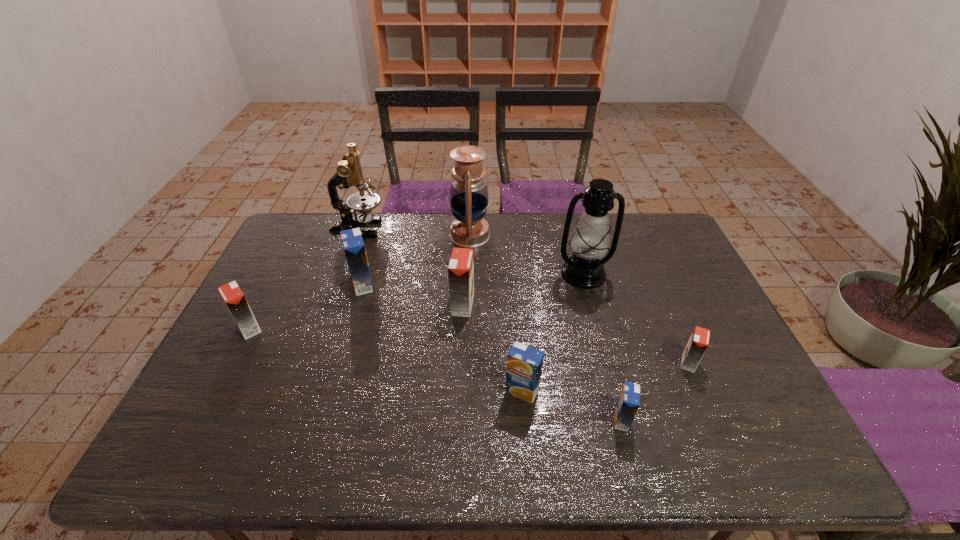
Find the location of a particular element. The height and width of the screenshot is (540, 960). free spot that satisfies the following two spatial constraints: 1. at the eyepiece of the microscope; 2. on the back side of the second orange_juice from left to right is located at coordinates (338, 285).

I want to click on free space that satisfies the following two spatial constraints: 1. on the front side of the farthest orange orange juice; 2. on the right side of the second farthest blue orange_juice, so click(x=459, y=390).

What are the coordinates of `vacant area in the image that satisfies the following two spatial constraints: 1. on the front side of the third nearest orange_juice; 2. on the left side of the third farthest orange_juice` in the screenshot? It's located at (231, 363).

You are a GUI agent. You are given a task and a screenshot of the screen. Output one action in this format:
    pyautogui.click(x=<x>, y=<y>)
    Task: Click on the blank area in the image that satisfies the following two spatial constraints: 1. at the eyepiece of the nearest orange_juice; 2. on the left side of the microscope
    The image size is (960, 540).
    Given the screenshot: What is the action you would take?
    pyautogui.click(x=291, y=420)

Identify the location of vacant space that satisfies the following two spatial constraints: 1. on the front side of the second smallest blue orange_juice; 2. on the left side of the farther oil lamp. point(466,390).

Where is `vacant region that satisfies the following two spatial constraints: 1. at the eyepiece of the microscope; 2. on the right side of the sixth object from left to right`? The image size is (960, 540). vacant region that satisfies the following two spatial constraints: 1. at the eyepiece of the microscope; 2. on the right side of the sixth object from left to right is located at coordinates (301, 390).

You are a GUI agent. You are given a task and a screenshot of the screen. Output one action in this format:
    pyautogui.click(x=<x>, y=<y>)
    Task: Click on the free region that satisfies the following two spatial constraints: 1. at the eyepiece of the rightmost blue orange_juice; 2. on the right side of the gray microscope
    
    Given the screenshot: What is the action you would take?
    pyautogui.click(x=291, y=420)